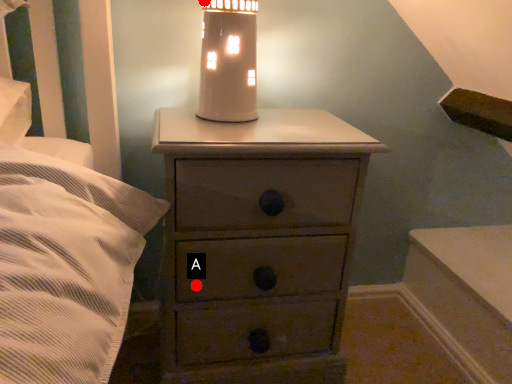
Question: Two points are circled on the image, labeled by A and B beside each circle. Which point is further to the camera?

Choices:
 (A) A is further
 (B) B is further

Answer: (B)